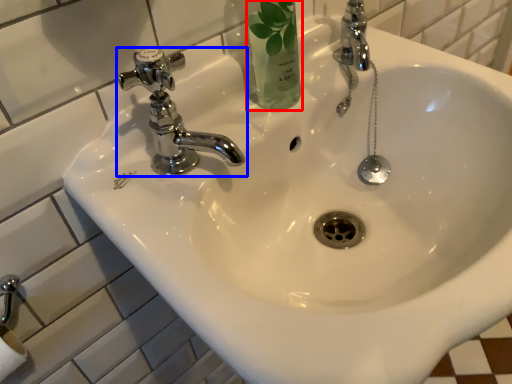
Question: Among these objects, which one is farthest to the camera, mouthwash (highlighted by a red box) or tap (highlighted by a blue box)?

Choices:
 (A) mouthwash
 (B) tap

Answer: (A)